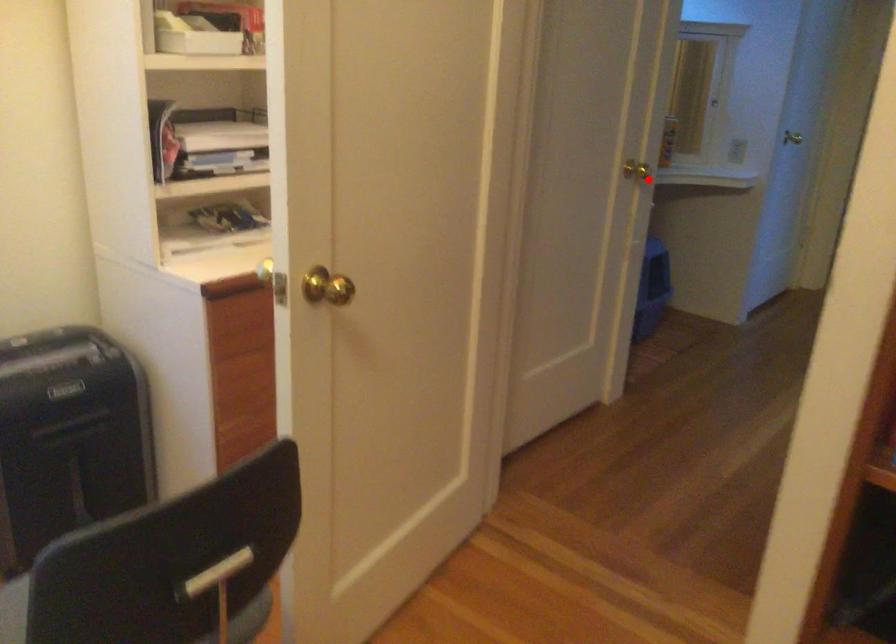
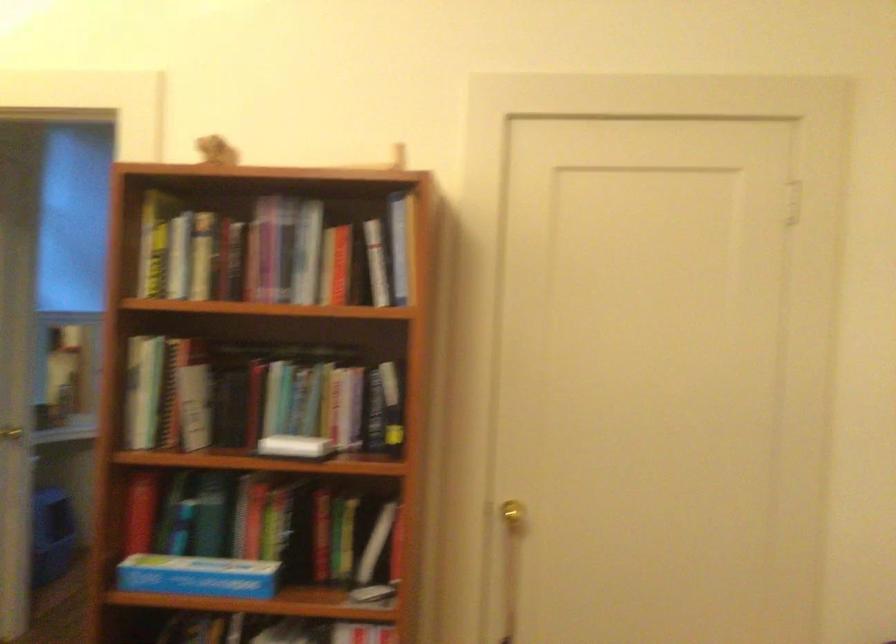
The point at the highlighted location is marked in the first image. Where is the corresponding point in the second image?

(11, 433)